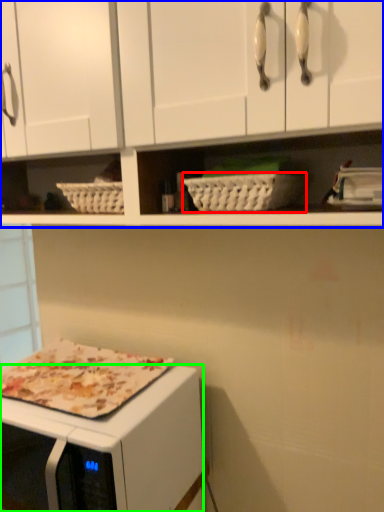
Question: Which is nearer to the basket (highlighted by a red box)? cabinetry (highlighted by a blue box) or microwave oven (highlighted by a green box).

Choices:
 (A) cabinetry
 (B) microwave oven

Answer: (A)